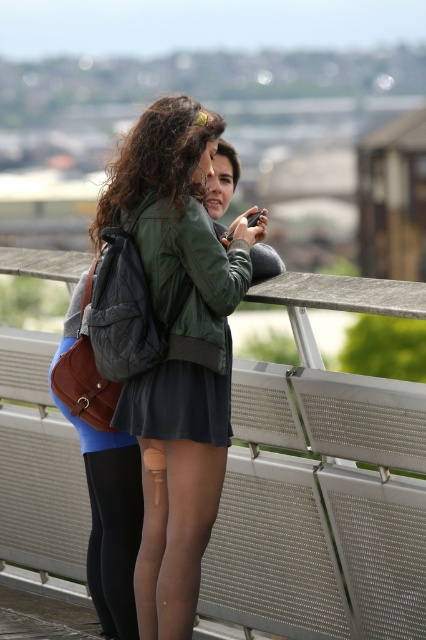
Is metallic gray balustrade at center positioned behind dark gray matte dress at center?

No, metallic gray balustrade at center is in front of dark gray matte dress at center.

Does point (241, 369) lie in front of point (201, 369)?

That is False.

Locate an element on the screen. This screenshot has height=640, width=426. metallic gray balustrade at center is located at coordinates (314, 339).

I want to click on metallic gray balustrade at center, so click(x=314, y=339).

Which is behind, point (141, 374) or point (13, 248)?

The point (13, 248) is more distant.

Which is more to the right, matte green bomber jacket at center or metallic gray balustrade at center?

metallic gray balustrade at center is more to the right.

Which is in front, point (118, 198) or point (325, 381)?

Point (118, 198)

This screenshot has height=640, width=426. I want to click on matte green bomber jacket at center, so click(x=178, y=349).

Can you confirm if matte green bomber jacket at center is positioned to the left of dark gray matte dress at center?

No, matte green bomber jacket at center is not to the left of dark gray matte dress at center.

Find the location of a particular element. matte green bomber jacket at center is located at coordinates (178, 349).